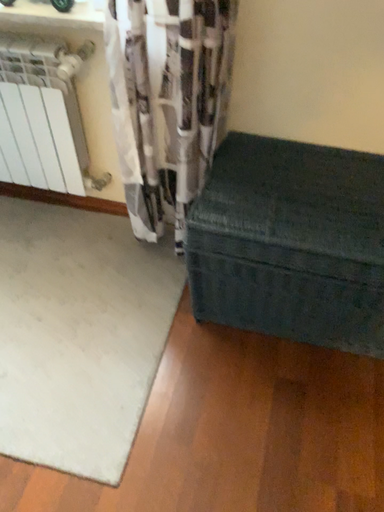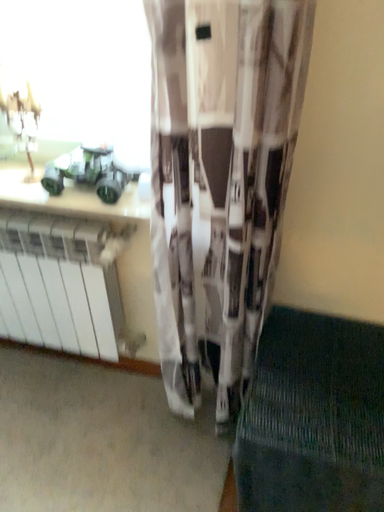
Question: How did the camera likely rotate when shooting the video?

Choices:
 (A) rotated upward
 (B) rotated downward

Answer: (A)